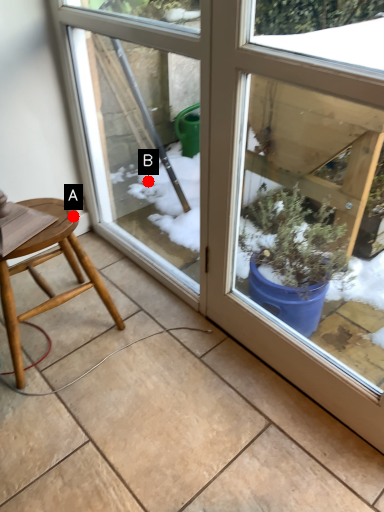
Question: Two points are circled on the image, labeled by A and B beside each circle. Which of the following is the closest to the observer?

Choices:
 (A) A is closer
 (B) B is closer

Answer: (A)